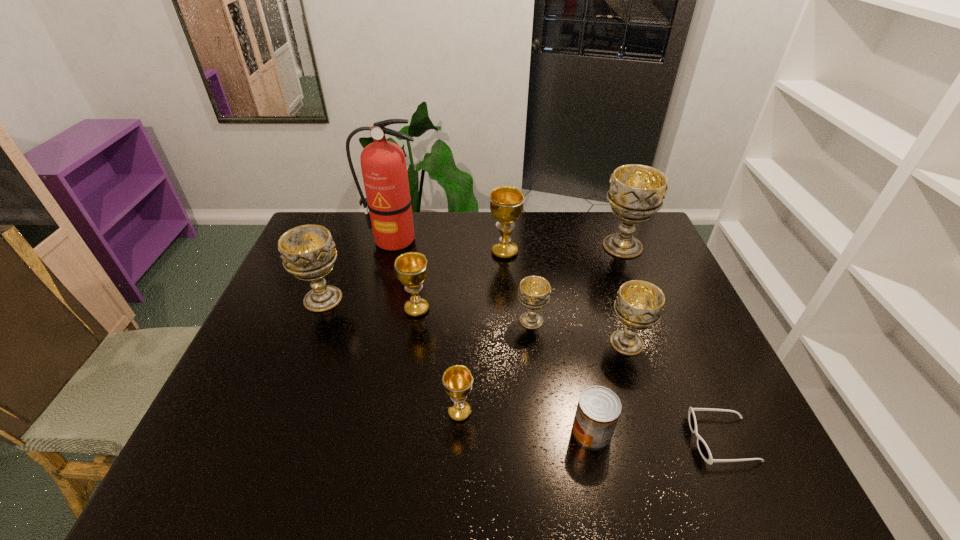
This screenshot has width=960, height=540. What are the coordinates of `fire extinguisher situated at the far edge` in the screenshot? It's located at (383, 164).

Find the location of a particular element. This screenshot has height=540, width=960. can at the near edge is located at coordinates (598, 410).

The image size is (960, 540). What are the coordinates of `sunglasses positioned at the near edge` in the screenshot? It's located at (701, 444).

The image size is (960, 540). I want to click on object that is positioned at the left edge, so click(308, 251).

At what (x,y) coordinates should I click in order to perform the action: click on chalice that is at the right edge. Please return your answer as a coordinate pair (x, y). Image resolution: width=960 pixels, height=540 pixels. Looking at the image, I should click on (636, 192).

At what (x,y) coordinates should I click in order to perform the action: click on sunglasses that is at the right edge. Please return your answer as a coordinate pair (x, y). The height and width of the screenshot is (540, 960). Looking at the image, I should click on (701, 444).

Identify the location of object located in the far right corner section of the desktop. (636, 192).

Where is `object that is at the near right corner`? This screenshot has height=540, width=960. object that is at the near right corner is located at coordinates (701, 444).

Where is `free location at the far edge of the desktop`? Image resolution: width=960 pixels, height=540 pixels. free location at the far edge of the desktop is located at coordinates (360, 216).

At what (x,y) coordinates should I click in order to perform the action: click on vacant position at the near edge of the desktop. Please return your answer as a coordinate pair (x, y). Image resolution: width=960 pixels, height=540 pixels. Looking at the image, I should click on (318, 482).